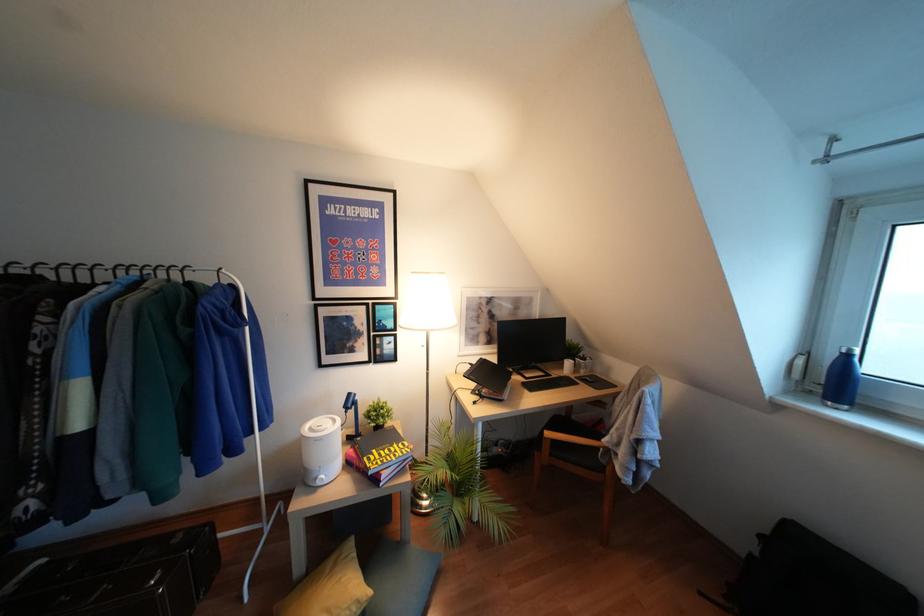
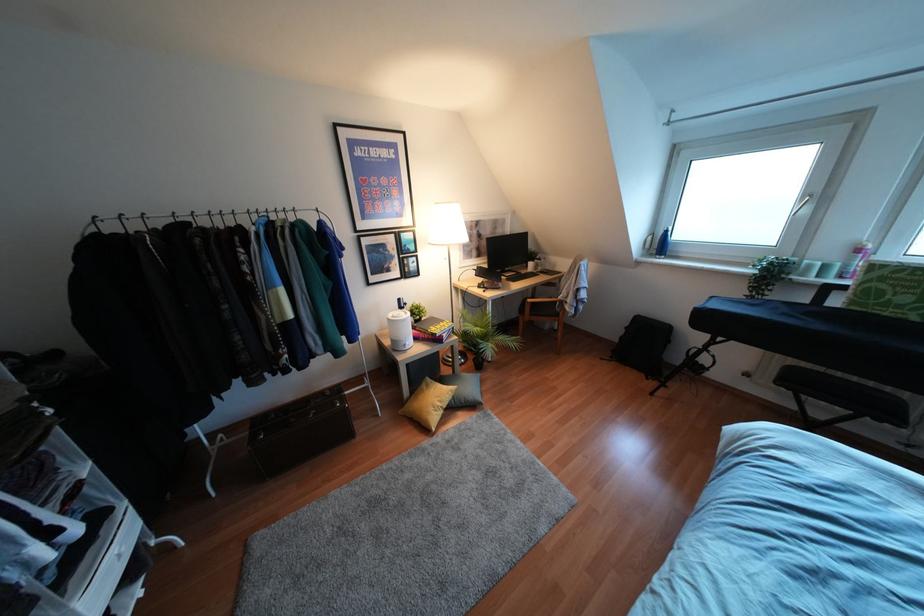
Locate, in the second image, the point that corresponds to (749,554) in the first image.

(621, 337)